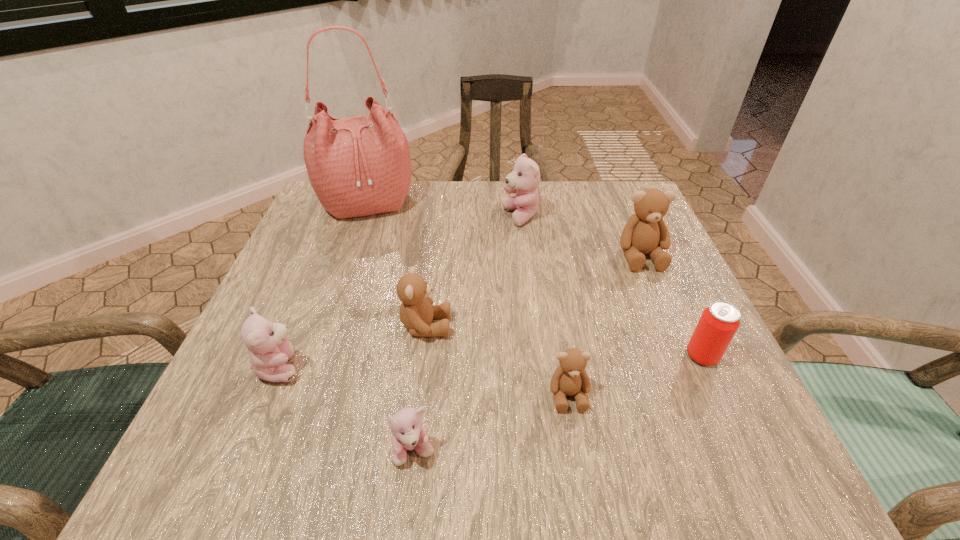
What are the coordinates of `free space that is in between the leftmost brown teddy bear and the second smallest pink teddy bear` in the screenshot? It's located at (353, 347).

You are a GUI agent. You are given a task and a screenshot of the screen. Output one action in this format:
    pyautogui.click(x=<x>, y=<y>)
    Task: Click on the vacant region between the smallest pink teddy bear and the farthest teddy bear
    
    Given the screenshot: What is the action you would take?
    pyautogui.click(x=468, y=334)

At what (x,y) coordinates should I click in order to perform the action: click on vacant region between the nearest pink teddy bear and the second biggest pink teddy bear. Please return your answer as a coordinate pair (x, y). The image size is (960, 540). Looking at the image, I should click on (348, 409).

At what (x,y) coordinates should I click in order to perform the action: click on free space between the second brown teddy bear from left to right and the red beer can. Please return your answer as a coordinate pair (x, y). Image resolution: width=960 pixels, height=540 pixels. Looking at the image, I should click on (636, 375).

Identify the location of vacant point located between the handbag and the second smallest brown teddy bear. (396, 265).

In order to click on free area in between the nearest object and the second brown teddy bear from left to right in this screenshot , I will do `click(492, 423)`.

This screenshot has height=540, width=960. I want to click on object that ranks as the second closest to the third farthest teddy bear, so click(x=408, y=433).

Select which object appears as the third closest to the smallest brown teddy bear. Please provide its 2D coordinates. Your answer should be formatted as a tuple, i.e. [(x, y)], where the tuple contains the x and y coordinates of a point satisfying the conditions above.

[(719, 322)]

Identify which teddy bear is the fourth closest to the second nearest pink teddy bear. Please provide its 2D coordinates. Your answer should be formatted as a tuple, i.e. [(x, y)], where the tuple contains the x and y coordinates of a point satisfying the conditions above.

[(524, 180)]

Identify which teddy bear is the third closest to the nearest brown teddy bear. Please provide its 2D coordinates. Your answer should be formatted as a tuple, i.e. [(x, y)], where the tuple contains the x and y coordinates of a point satisfying the conditions above.

[(645, 232)]